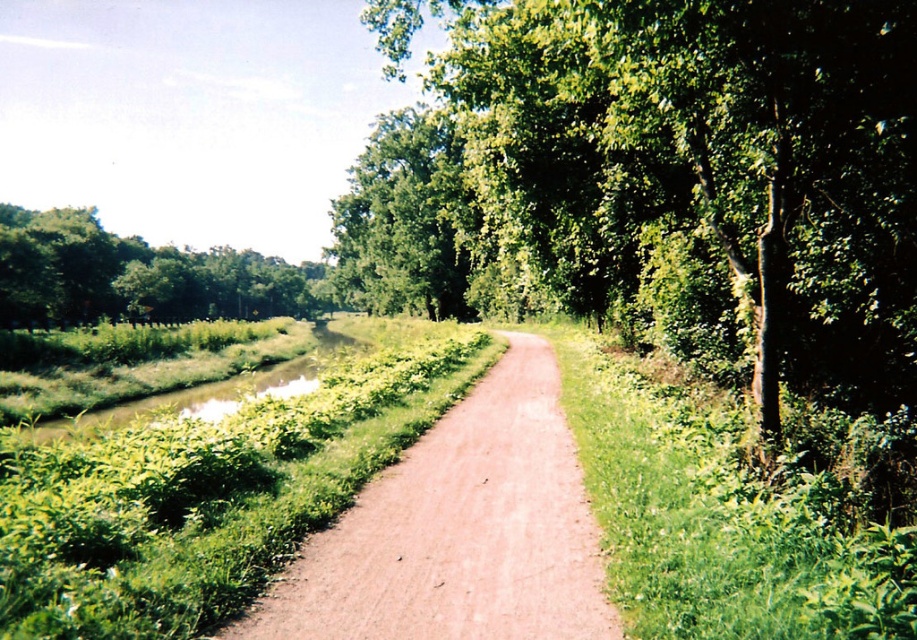
Question: Estimate the real-world distances between objects in this image. Which object is farther from the green leafy tree at center?

Choices:
 (A) dirt path at center
 (B) green grassy bank at center
 (C) green leafy tree at upper left

Answer: (C)

Question: Which point is closer to the camera?

Choices:
 (A) green leafy tree at upper left
 (B) green grassy bank at center

Answer: (B)

Question: Which point is farther to the camera?

Choices:
 (A) green grassy bank at center
 (B) green leafy tree at center

Answer: (A)

Question: Can you confirm if green leafy tree at center is positioned above green grassy bank at center?

Choices:
 (A) yes
 (B) no

Answer: (A)

Question: Does dirt path at center have a lesser width compared to green leafy tree at upper left?

Choices:
 (A) yes
 (B) no

Answer: (A)

Question: In this image, where is green leafy tree at center located relative to green grassy bank at center?

Choices:
 (A) below
 (B) above

Answer: (B)